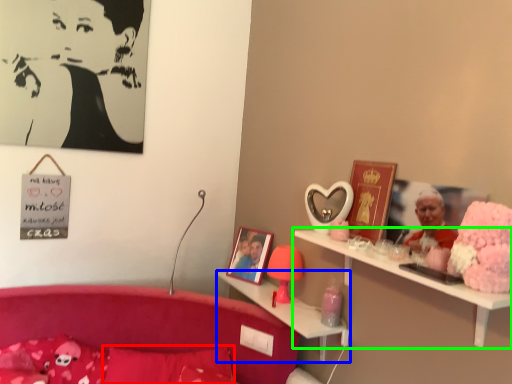
Question: Considering the real-world distances, which object is closest to pillow (highlighted by a red box)? shelf (highlighted by a blue box) or shelf (highlighted by a green box).

Choices:
 (A) shelf
 (B) shelf

Answer: (A)